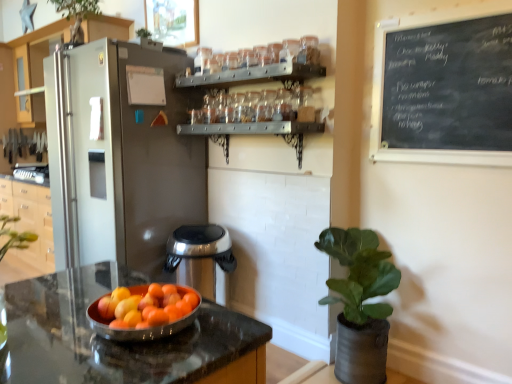
Question: Is satin silver refrigerator at left positioned beyond the bounds of black chalkboard at upper right?

Choices:
 (A) no
 (B) yes

Answer: (B)

Question: Considering the relative sizes of satin silver refrigerator at left and black chalkboard at upper right in the image provided, is satin silver refrigerator at left smaller than black chalkboard at upper right?

Choices:
 (A) no
 (B) yes

Answer: (A)

Question: From the image's perspective, is satin silver refrigerator at left above black chalkboard at upper right?

Choices:
 (A) no
 (B) yes

Answer: (B)

Question: Does satin silver refrigerator at left contain black chalkboard at upper right?

Choices:
 (A) no
 (B) yes

Answer: (A)

Question: Is satin silver refrigerator at left to the right of black chalkboard at upper right from the viewer's perspective?

Choices:
 (A) no
 (B) yes

Answer: (A)

Question: From the image's perspective, does satin silver refrigerator at left appear lower than black chalkboard at upper right?

Choices:
 (A) no
 (B) yes

Answer: (A)

Question: Is shiny granite countertop at center oriented towards shiny metallic bowl at center?

Choices:
 (A) no
 (B) yes

Answer: (A)

Question: From the image's perspective, does shiny granite countertop at center appear lower than shiny metallic bowl at center?

Choices:
 (A) yes
 (B) no

Answer: (A)

Question: From a real-world perspective, is shiny granite countertop at center located higher than shiny metallic bowl at center?

Choices:
 (A) no
 (B) yes

Answer: (A)

Question: From a real-world perspective, is shiny granite countertop at center beneath shiny metallic bowl at center?

Choices:
 (A) no
 (B) yes

Answer: (B)

Question: Can you confirm if shiny granite countertop at center is bigger than shiny metallic bowl at center?

Choices:
 (A) yes
 (B) no

Answer: (A)

Question: Is shiny granite countertop at center not near shiny metallic bowl at center?

Choices:
 (A) no
 (B) yes

Answer: (A)

Question: Does satin silver refrigerator at left have a greater width compared to clear glass jars at upper center?

Choices:
 (A) yes
 (B) no

Answer: (A)